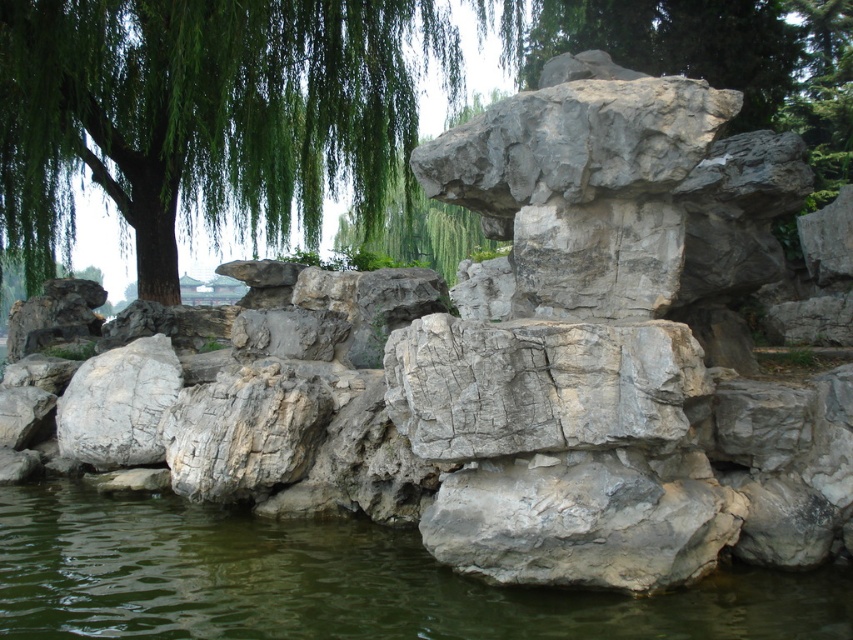
In the scene shown: Based on the coordinates provided, where is the green leafy willow at upper left located in the image?

The green leafy willow at upper left is located at coordinates point (207,116).

Consider the image. You are an artist sketching this scene. You need to decide which object to draw first based on their thickness. Which one should you start with, the green leafy willow at upper left or the green water at lower center?

The green leafy willow at upper left is thinner than the green water at lower center, so you should start with the green leafy willow at upper left since it requires more detailed lines for its thinner structure.

You are standing at the center of the image and want to reach the point marked as point (207, 116). Which direction should you move to get there?

The point (207, 116) is located on the green leafy willow at upper left, so you should move towards the upper left direction to reach it.